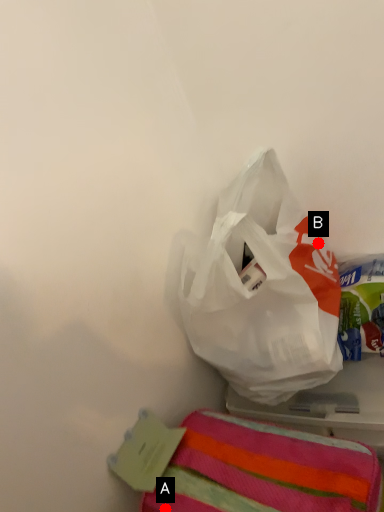
Question: Two points are circled on the image, labeled by A and B beside each circle. Which point is closer to the camera?

Choices:
 (A) A is closer
 (B) B is closer

Answer: (A)